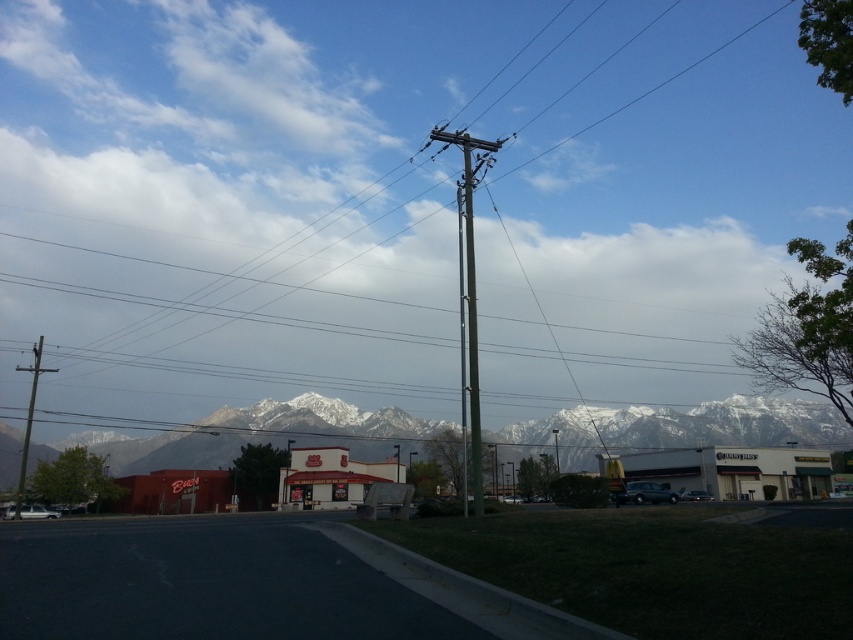
Question: Can you confirm if green metallic pole at center is positioned above brown wooden telegraph pole at left?

Choices:
 (A) yes
 (B) no

Answer: (A)

Question: Is snowy white mountains at center wider than brown wooden telegraph pole at left?

Choices:
 (A) no
 (B) yes

Answer: (B)

Question: Can you confirm if green metallic pole at center is wider than green wooden telegraph pole at center?

Choices:
 (A) no
 (B) yes

Answer: (B)

Question: Based on their relative distances, which object is nearer to the snowy white mountains at center?

Choices:
 (A) green metallic pole at center
 (B) brown wooden telegraph pole at left
 (C) green wooden telegraph pole at center

Answer: (A)

Question: Based on their relative distances, which object is farther from the snowy white mountains at center?

Choices:
 (A) green metallic pole at center
 (B) brown wooden telegraph pole at left
 (C) green wooden telegraph pole at center

Answer: (C)

Question: Based on their relative distances, which object is farther from the green metallic pole at center?

Choices:
 (A) snowy white mountains at center
 (B) brown wooden telegraph pole at left
 (C) green wooden telegraph pole at center

Answer: (B)